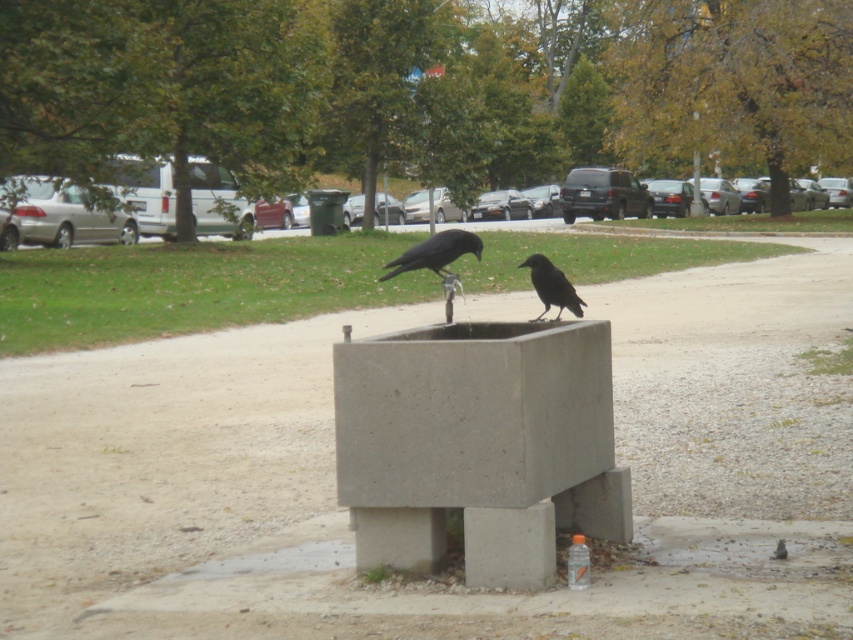
You are a park visitor who wants to feed the birds at the fountain. You have two bird feeders, one in your left hand and one in your right hand. If you face the fountain, which raven should you place the feeder in your left hand to, the shiny black raven at center or the black matte raven at center?

You should place the feeder in your left hand to the shiny black raven at center because it is positioned to the left of the black matte raven at center.